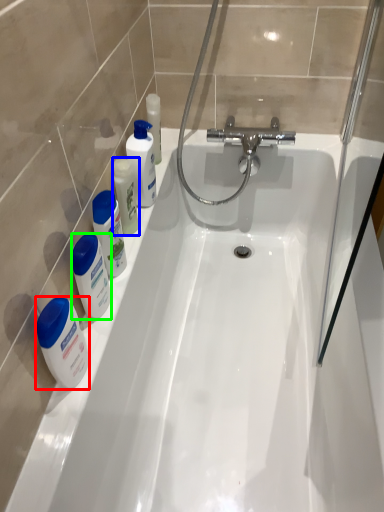
Question: Based on their relative distances, which object is nearer to mouthwash (highlighted by a red box)? Choose from mouthwash (highlighted by a blue box) and cleaning product (highlighted by a green box).

Choices:
 (A) mouthwash
 (B) cleaning product

Answer: (B)